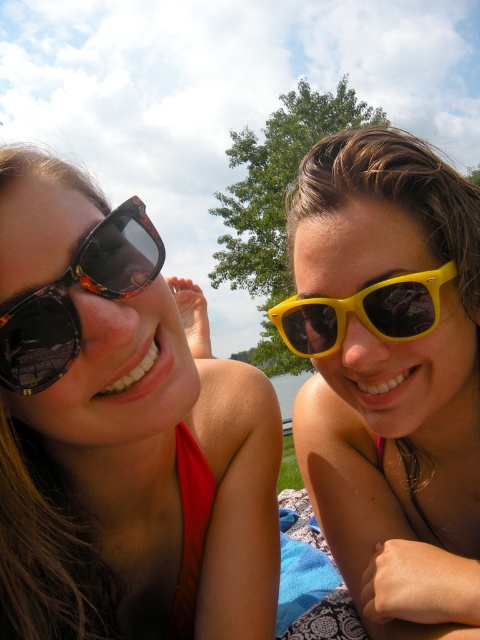
Question: Is yellow plastic sunglasses at upper right to the left of blue fabric at lower right from the viewer's perspective?

Choices:
 (A) yes
 (B) no

Answer: (B)

Question: Which point is farther from the camera taking this photo?

Choices:
 (A) (17, 330)
 (B) (291, 609)
 (C) (450, 273)
 (D) (78, 602)

Answer: (B)

Question: Can you confirm if matte black sunglasses at left is positioned below yellow plastic sunglasses at upper right?

Choices:
 (A) yes
 (B) no

Answer: (A)

Question: Among these points, which one is nearest to the camera?

Choices:
 (A) (287, 570)
 (B) (206, 552)

Answer: (B)

Question: Among these objects, which one is nearest to the camera?

Choices:
 (A) blue fabric at lower right
 (B) matte black sunglasses at left
 (C) yellow plastic sunglasses at right
 (D) yellow plastic sunglasses at upper right

Answer: (B)

Question: Is tortoiseshell plastic sunglasses at left behind blue fabric at lower right?

Choices:
 (A) no
 (B) yes

Answer: (A)